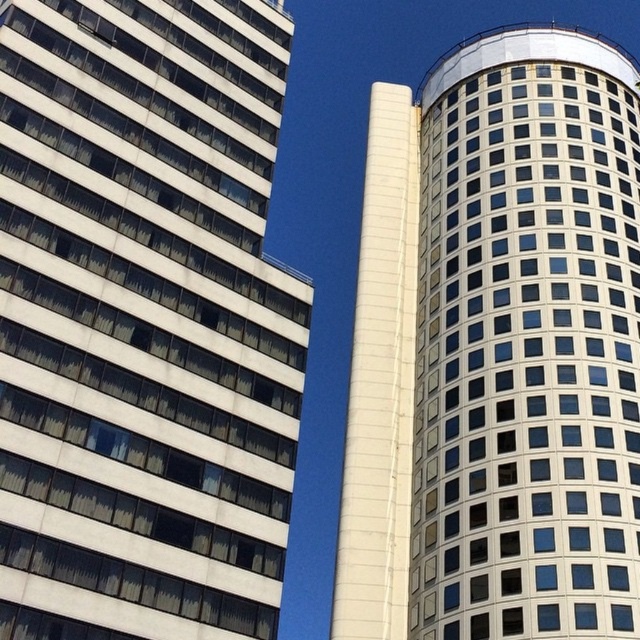
Question: Can you confirm if white glass building at left is positioned to the left of white glass building at right?

Choices:
 (A) yes
 (B) no

Answer: (A)

Question: Can you confirm if white glass building at left is positioned above white glass building at right?

Choices:
 (A) yes
 (B) no

Answer: (B)

Question: Can you confirm if white glass building at left is positioned to the left of white glass building at right?

Choices:
 (A) yes
 (B) no

Answer: (A)